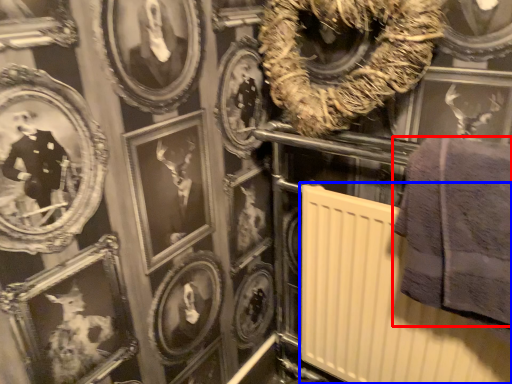
Question: Which of the following is the farthest to the observer, towel (highlighted by a red box) or radiator (highlighted by a blue box)?

Choices:
 (A) towel
 (B) radiator

Answer: (B)